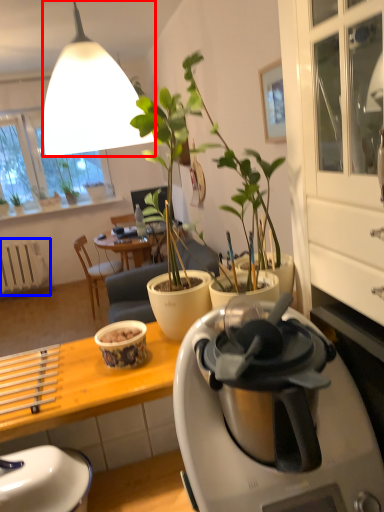
Question: Among these objects, which one is farthest to the camera, lamp (highlighted by a red box) or radiator (highlighted by a blue box)?

Choices:
 (A) lamp
 (B) radiator

Answer: (B)